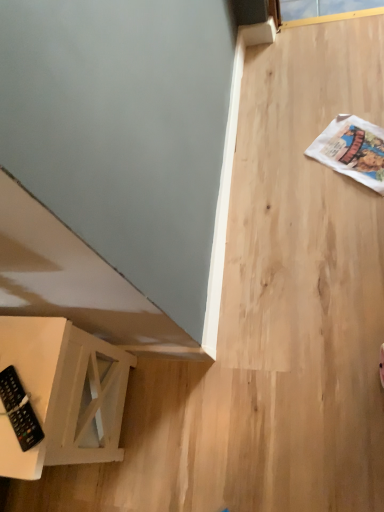
Find the location of `free location above white wood side table at lower left (from a real-world perspective)`. free location above white wood side table at lower left (from a real-world perspective) is located at coordinates (23, 376).